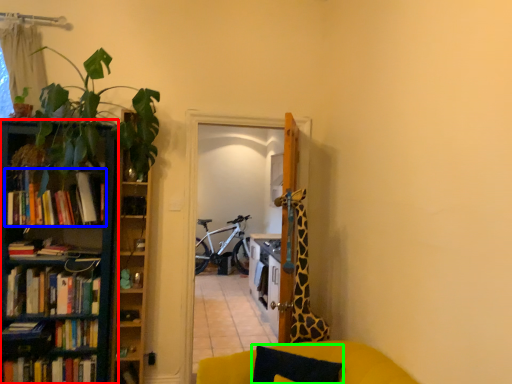
Question: Which object is the closest to the bookcase (highlighted by a red box)? Choose among these: book (highlighted by a blue box) or pillow (highlighted by a green box).

Choices:
 (A) book
 (B) pillow

Answer: (A)